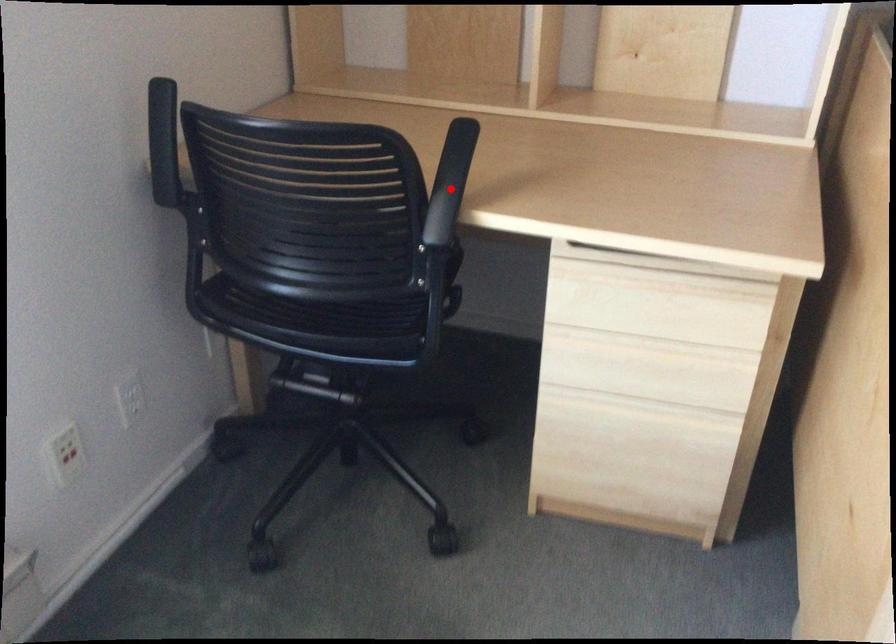
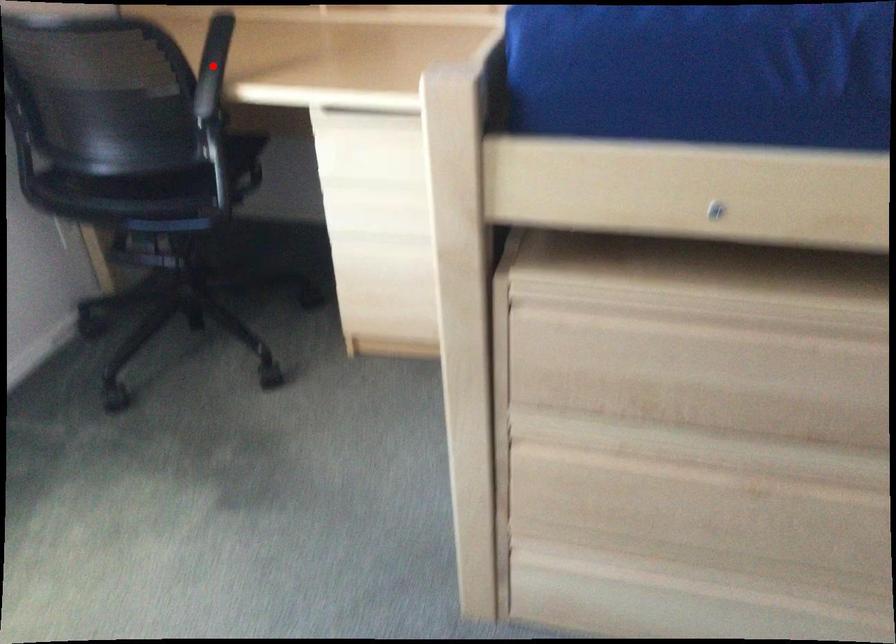
I am providing you with two images of the same scene from different viewpoints. A red point is marked on the first image and another point is marked on the second image. Are the points marked in image1 and image2 representing the same 3D position?

Yes